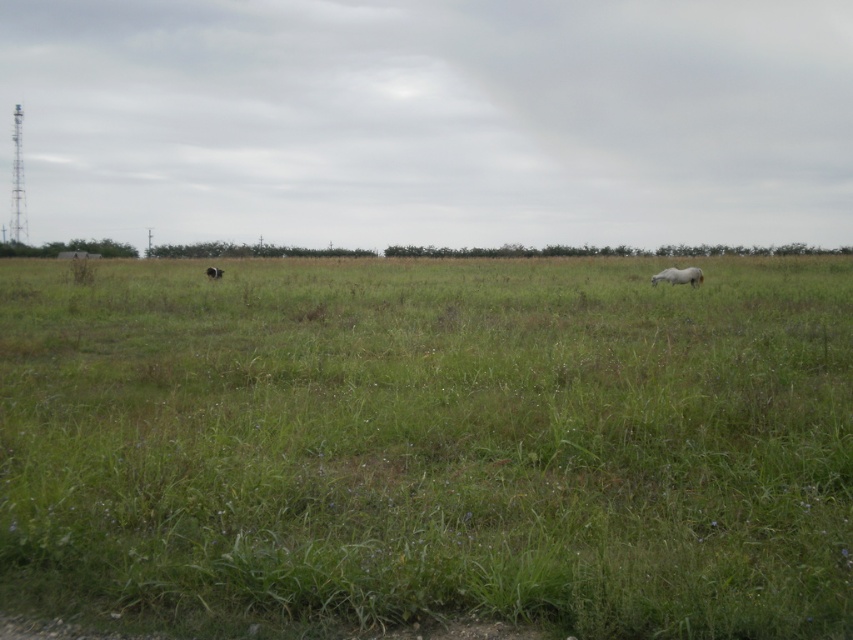
Which is in front, point (183, 588) or point (212, 268)?

Point (183, 588) is in front.

Locate an element on the screen. The height and width of the screenshot is (640, 853). green grass at center is located at coordinates 433,442.

Which of these two, white fluffy horse at center or brown fuzzy dog at center, stands taller?

With more height is brown fuzzy dog at center.

Is the position of white fluffy horse at center more distant than that of brown fuzzy dog at center?

No.

Between point (698, 276) and point (210, 268), which one is positioned in front?

Positioned in front is point (698, 276).

Where is `white fluffy horse at center`? The width and height of the screenshot is (853, 640). white fluffy horse at center is located at coordinates (677, 275).

Can you confirm if green grass at center is taller than white fluffy horse at center?

Yes, green grass at center is taller than white fluffy horse at center.

Between green grass at center and white fluffy horse at center, which one has more height?

green grass at center

I want to click on green grass at center, so click(433, 442).

Identify the location of green grass at center. (433, 442).